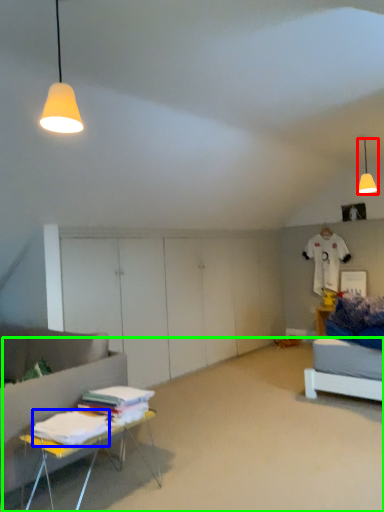
Question: Estimate the real-world distances between objects in this image. Which object is farther from lamp (highlighted by a red box), sheet (highlighted by a blue box) or plain (highlighted by a green box)?

Choices:
 (A) sheet
 (B) plain

Answer: (A)